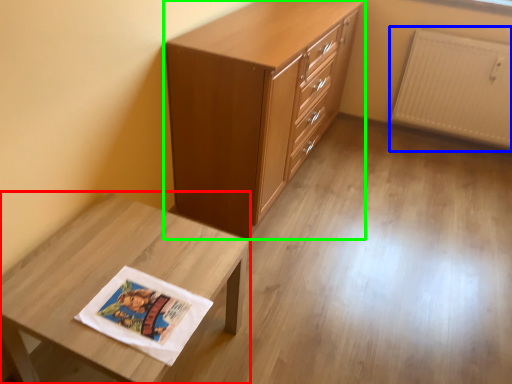
Question: Based on their relative distances, which object is nearer to table (highlighted by a red box)? Choose from radiator (highlighted by a blue box) and chest of drawers (highlighted by a green box).

Choices:
 (A) radiator
 (B) chest of drawers

Answer: (B)